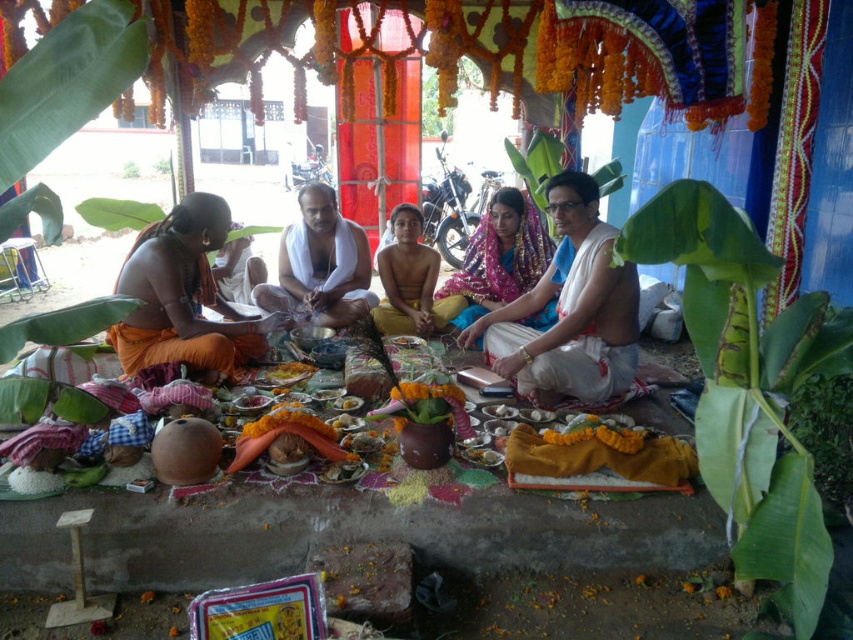
Question: Which of the following is the farthest from the observer?

Choices:
 (A) (425, 264)
 (B) (582, 220)

Answer: (A)

Question: Which point is farther from the camera taking this photo?

Choices:
 (A) (624, 323)
 (B) (392, 272)
 (C) (314, 195)

Answer: (B)

Question: Which of the following is the farthest from the observer?

Choices:
 (A) white clothed man at center
 (B) brown skin child at center

Answer: (B)

Question: Is the position of white clothed man at center more distant than that of brown skin child at center?

Choices:
 (A) no
 (B) yes

Answer: (A)

Question: Is silk saree at center smaller than brown skin child at center?

Choices:
 (A) no
 (B) yes

Answer: (A)

Question: From the image, what is the correct spatial relationship of white clothed man at center in relation to brown skin child at center?

Choices:
 (A) below
 (B) above

Answer: (B)